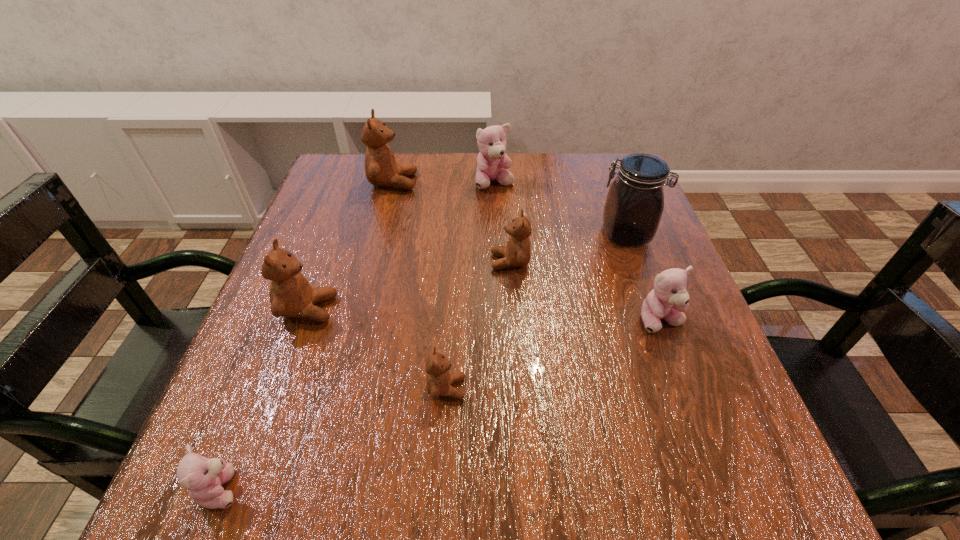
The width and height of the screenshot is (960, 540). Identify the location of the seventh farthest object. (439, 380).

This screenshot has width=960, height=540. Find the location of `the sixth farthest teddy bear`. the sixth farthest teddy bear is located at coordinates (439, 380).

Find the location of a particular element. This screenshot has height=540, width=960. the nearest teddy bear is located at coordinates (203, 478).

In order to click on the leftmost pink teddy bear in this screenshot , I will do `click(203, 478)`.

Identify the location of vacant space located on the face of the tallest teddy bear. The width and height of the screenshot is (960, 540). (468, 182).

What are the coordinates of `vacant space positioned 0.360m on the lid of the jar` in the screenshot? It's located at (433, 234).

Where is `free region located on the lid of the jar`? free region located on the lid of the jar is located at coordinates tap(533, 234).

Where is `vacant area situated on the lid of the jar`? The height and width of the screenshot is (540, 960). vacant area situated on the lid of the jar is located at coordinates (488, 234).

Identify the location of blank area located at the face of the second pink teddy bear from left to right. This screenshot has width=960, height=540. (497, 241).

The height and width of the screenshot is (540, 960). What are the coordinates of `blank area located on the face of the second biggest brown teddy bear` in the screenshot? It's located at (551, 309).